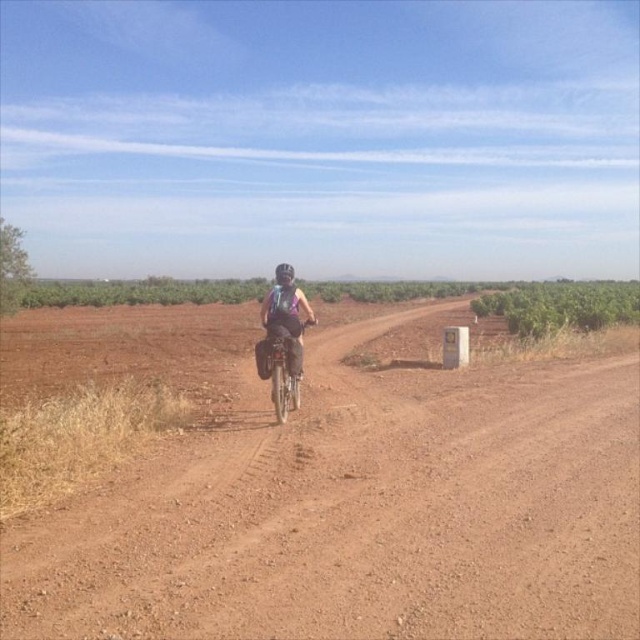
You are navigating a drone over a rural area and need to land it precisely on the brown gravel road at center. According to the image, what are the coordinates where you should direct the drone to land?

The brown gravel road at center is located at coordinates point (358,512), so you should direct the drone to land there.

You are a cyclist planning to ride along the brown gravel road at center. You notice the matte purple backpack at center is placed on the side of the road. Which side of the road should you avoid to stay safe?

The brown gravel road at center is positioned on the right side of the matte purple backpack at center, so you should avoid the right side of the road to stay safe.